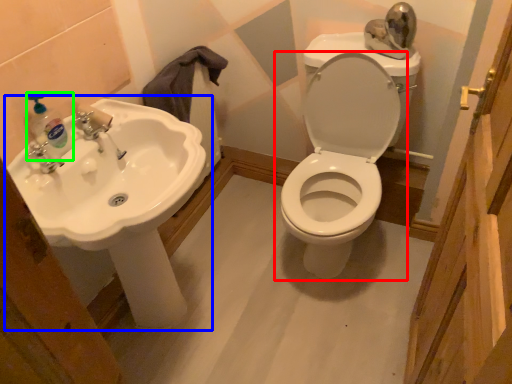
Question: Estimate the real-world distances between objects in this image. Which object is farther from toilet (highlighted by a red box), sink (highlighted by a blue box) or soap dispenser (highlighted by a green box)?

Choices:
 (A) sink
 (B) soap dispenser

Answer: (B)